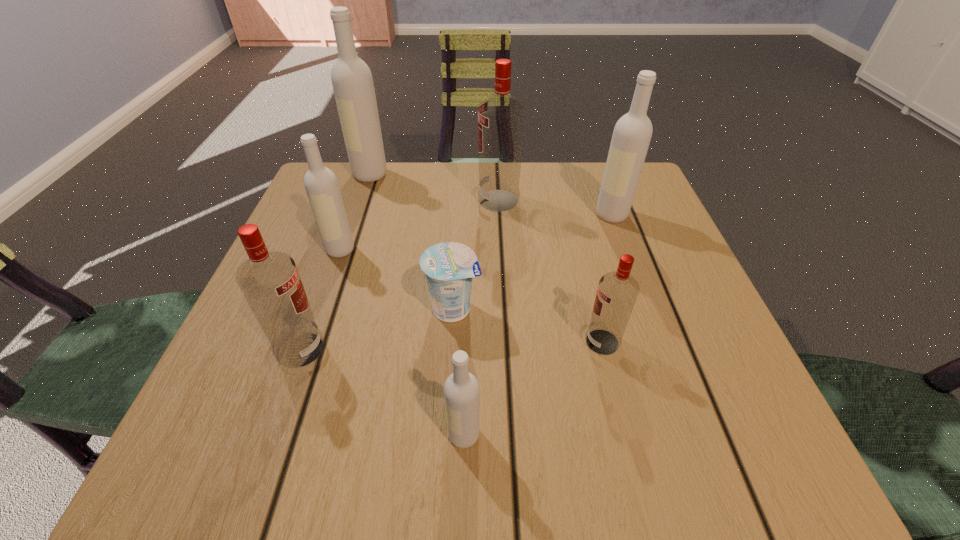
Image resolution: width=960 pixels, height=540 pixels. Identify the location of unoccupied position between the tallest object and the shortest object. (412, 242).

This screenshot has height=540, width=960. Find the location of `free space between the rightmost white vodka and the biggest red vodka`. free space between the rightmost white vodka and the biggest red vodka is located at coordinates (556, 207).

The image size is (960, 540). In order to click on vacant space in between the farthest red vodka and the second object from right to left in this screenshot , I will do `click(551, 271)`.

Identify the location of free spot between the shortest object and the farthest white vodka. Image resolution: width=960 pixels, height=540 pixels. (412, 242).

The width and height of the screenshot is (960, 540). I want to click on free area in between the nearest white vodka and the rightmost object, so click(x=538, y=325).

Identify the location of vacant area that lies between the second smallest white vodka and the second biggest white vodka. This screenshot has width=960, height=540. (476, 232).

Where is `object that is the sixth closest to the blue yogurt`? object that is the sixth closest to the blue yogurt is located at coordinates click(x=632, y=133).

Find the location of a particular element. the sixth closest object to the rightmost object is located at coordinates (461, 389).

Locate an element on the screen. The height and width of the screenshot is (540, 960). the third closest vodka to the second red vodka from left to right is located at coordinates (322, 188).

Select which vodka is the second closest to the biggest white vodka. Please provide its 2D coordinates. Your answer should be formatted as a tuple, i.e. [(x, y)], where the tuple contains the x and y coordinates of a point satisfying the conditions above.

[(501, 118)]